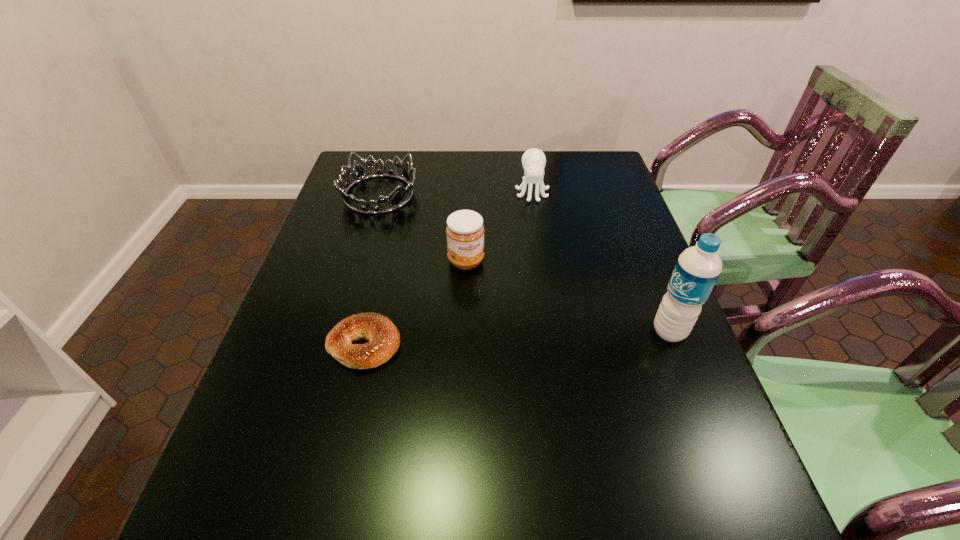
Identify the location of the shortest object. This screenshot has width=960, height=540. (384, 339).

You are a GUI agent. You are given a task and a screenshot of the screen. Output one action in this format:
    pyautogui.click(x=<x>, y=<y>)
    Task: Click on the tallest object
    The height and width of the screenshot is (540, 960).
    Given the screenshot: What is the action you would take?
    pyautogui.click(x=698, y=268)

Locate an element on the screen. The image size is (960, 540). water bottle is located at coordinates (698, 268).

Where is `octopus`? octopus is located at coordinates (533, 160).

At what (x,y) coordinates should I click in order to perform the action: click on the third object from right to left. Please return your answer as a coordinate pair (x, y). The height and width of the screenshot is (540, 960). Looking at the image, I should click on (465, 232).

Where is `jam`? The height and width of the screenshot is (540, 960). jam is located at coordinates (465, 232).

The width and height of the screenshot is (960, 540). Find the location of `tiara`. tiara is located at coordinates (359, 173).

Where is `vacant space located 0.310m on the back of the shortest object`? The width and height of the screenshot is (960, 540). vacant space located 0.310m on the back of the shortest object is located at coordinates (390, 237).

Locate an element on the screen. Image resolution: width=960 pixels, height=540 pixels. vacant region located 0.110m on the label of the tallest object is located at coordinates (604, 332).

Where is `vacant space located 0.310m on the label of the tallest object`? This screenshot has height=540, width=960. vacant space located 0.310m on the label of the tallest object is located at coordinates (516, 332).